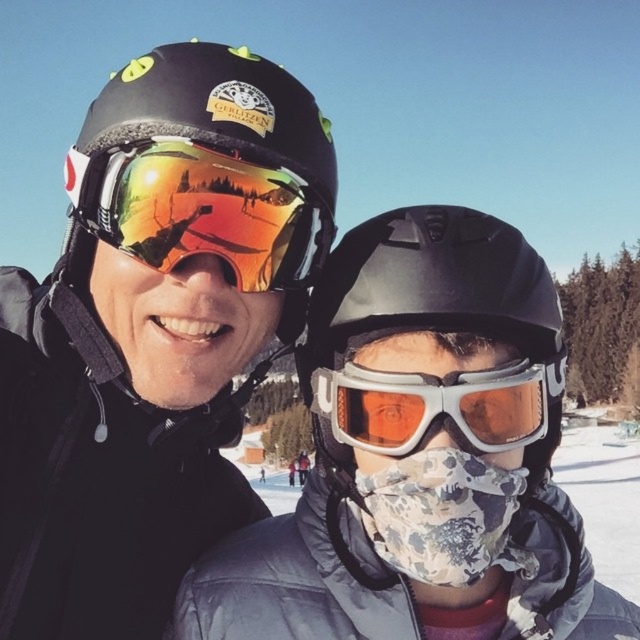
You are standing at the bottom of a snowy slope and see the two individuals in the image. The point at coordinates (x=198, y=211) indicates a specific location. Which object does this point correspond to?

The point at coordinates (x=198, y=211) corresponds to the matte black helmet at upper center.

You are designing a storage compartment for winter gear. The compartment has a fixed width. You need to place both the matte black helmet at upper center and the white matte goggles at center in the compartment. Which item requires more width in the compartment?

The matte black helmet at upper center requires more width in the compartment because it might be wider than the white matte goggles at center.